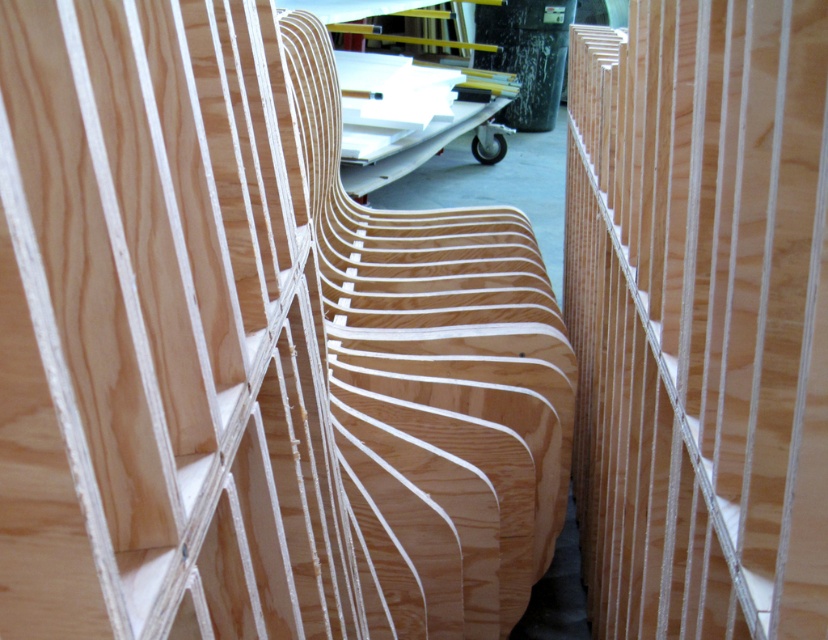
Which is above, natural wood chair at center or natural wood plywood at center?

natural wood plywood at center is above.

Can you confirm if natural wood chair at center is positioned to the left of natural wood plywood at center?

Indeed, natural wood chair at center is positioned on the left side of natural wood plywood at center.

Who is more distant from viewer, (132,403) or (724,147)?

The point (724,147) is more distant.

Where is `natural wood chair at center`? The image size is (828, 640). natural wood chair at center is located at coordinates (251, 353).